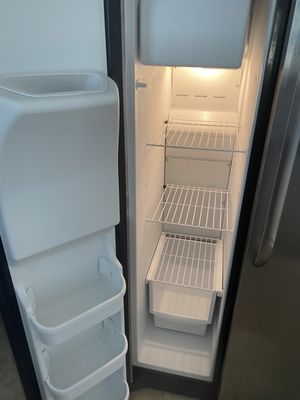
This screenshot has height=400, width=300. I want to click on fridge gate, so click(185, 141), click(173, 220), click(170, 280).